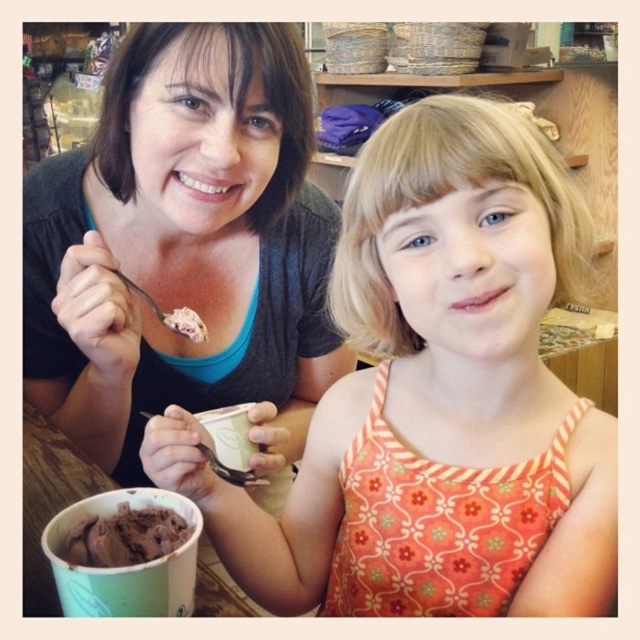
Question: Which object is closer to the camera taking this photo?

Choices:
 (A) chocolate ice cream at lower left
 (B) matte black shirt at upper left
 (C) orange floral tank top at center

Answer: (C)

Question: Which object is closer to the camera taking this photo?

Choices:
 (A) chocolate ice cream at lower left
 (B) matte black shirt at upper left
 (C) orange floral tank top at center

Answer: (C)

Question: Is orange floral tank top at center positioned at the back of matte black shirt at upper left?

Choices:
 (A) yes
 (B) no

Answer: (B)

Question: Which point is closer to the camera?

Choices:
 (A) (509, 592)
 (B) (145, 166)

Answer: (A)

Question: Is matte black shirt at upper left further to the viewer compared to chocolate ice cream at lower left?

Choices:
 (A) yes
 (B) no

Answer: (A)

Question: In this image, where is orange floral tank top at center located relative to chocolate ice cream at lower left?

Choices:
 (A) right
 (B) left

Answer: (A)